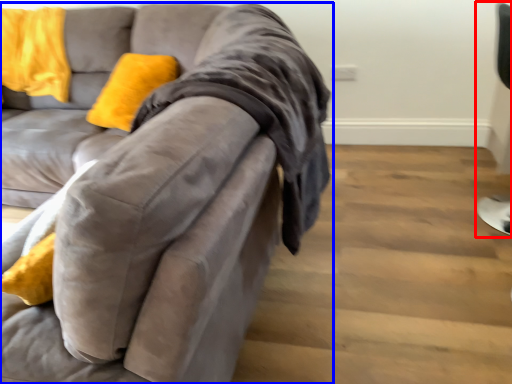
Question: Which point is further to the camera, computer chair (highlighted by a red box) or studio couch (highlighted by a blue box)?

Choices:
 (A) computer chair
 (B) studio couch

Answer: (A)